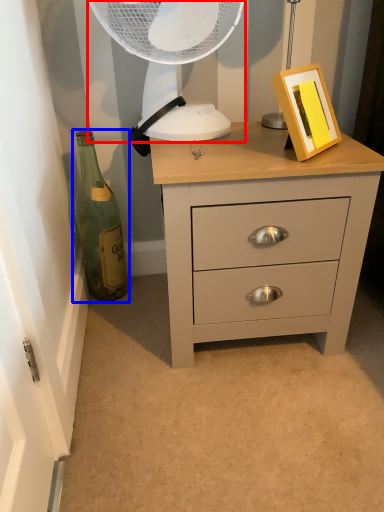
Question: Which of the following is the closest to the observer, mechanical fan (highlighted by a red box) or bottle (highlighted by a blue box)?

Choices:
 (A) mechanical fan
 (B) bottle

Answer: (A)